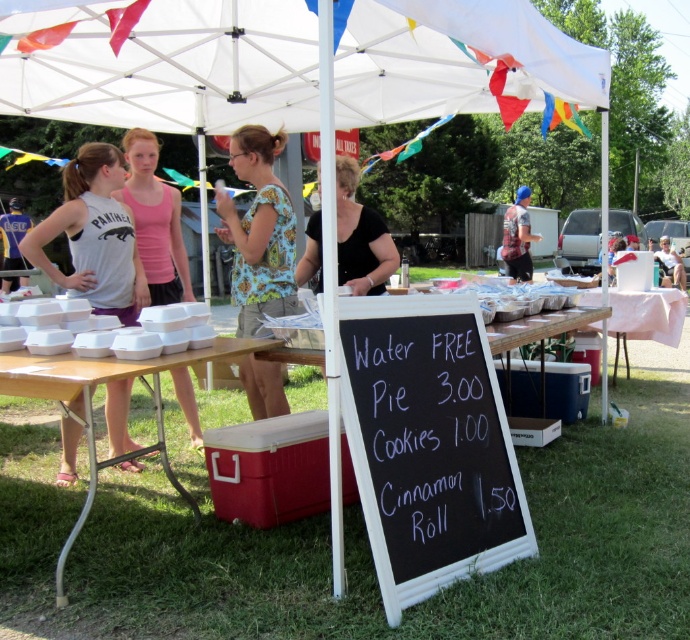
Question: Is white fabric canopy at upper center behind floral fabric blouse at center?

Choices:
 (A) no
 (B) yes

Answer: (B)

Question: Which point is farther to the camera?

Choices:
 (A) (108, 451)
 (B) (295, 33)

Answer: (B)

Question: Can you confirm if gray fabric tank top at left is smaller than white paper at right?

Choices:
 (A) yes
 (B) no

Answer: (A)

Question: Which of the following is the closest to the observer?

Choices:
 (A) blue knit cap at upper center
 (B) pink fabric shirt at left
 (C) gray fabric tank top at left
 (D) white fabric canopy at upper center

Answer: (C)

Question: Which point is closer to the camera?

Choices:
 (A) black chalkboard at center
 (B) floral fabric blouse at center
 (C) white paper at right
 (D) blue knit cap at upper center

Answer: (A)

Question: Can you confirm if gray fabric tank top at left is wider than white paper at right?

Choices:
 (A) no
 (B) yes

Answer: (A)